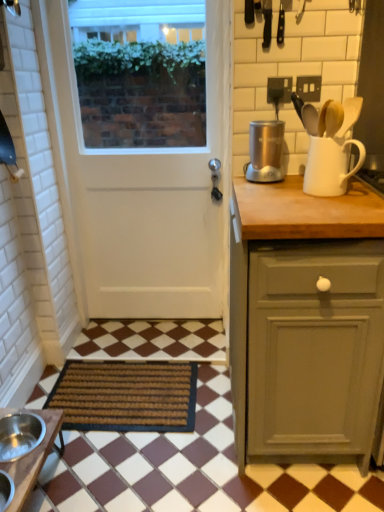
The height and width of the screenshot is (512, 384). I want to click on vacant space in front of satin silver appliance at upper right, so click(272, 186).